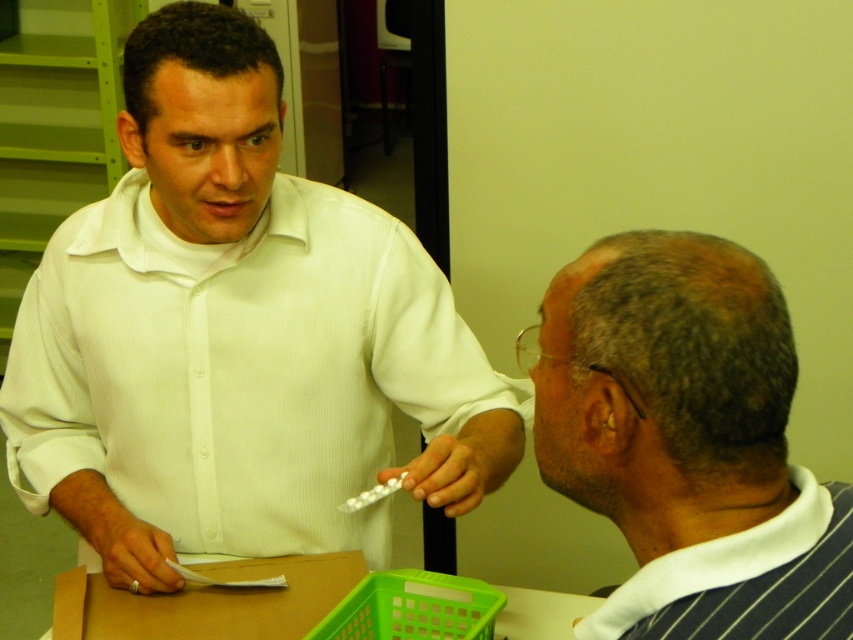
Question: Which of the following is the farthest from the observer?

Choices:
 (A) white pinstripe shirt at right
 (B) striped fabric shirt at right
 (C) white matte shirt at center
 (D) green plastic crate at lower center

Answer: (C)

Question: Is striped fabric shirt at right behind green plastic crate at lower center?

Choices:
 (A) yes
 (B) no

Answer: (B)

Question: Does white pinstripe shirt at right have a greater width compared to green plastic crate at lower center?

Choices:
 (A) yes
 (B) no

Answer: (A)

Question: Which point is farther from the camera taking this photo?

Choices:
 (A) (762, 474)
 (B) (389, 589)

Answer: (B)

Question: From the image, what is the correct spatial relationship of white matte shirt at center in relation to green plastic crate at lower center?

Choices:
 (A) above
 (B) below

Answer: (A)

Question: Which object is farther from the camera taking this photo?

Choices:
 (A) striped fabric shirt at right
 (B) white pinstripe shirt at right
 (C) white matte shirt at center
 (D) green plastic crate at lower center

Answer: (C)